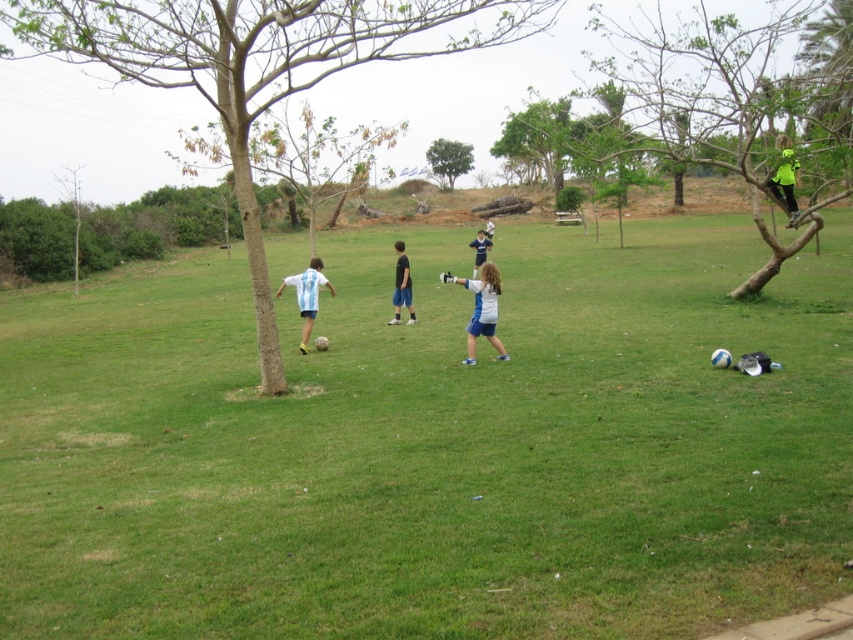
Consider the image. You are a photographer trying to capture the action of the soccer game. You want to position your camera so that the white matte shirt at center is centered in the frame. What coordinates should you aim for?

The white matte shirt at center is located at coordinates (480, 308), so you should aim your camera at those coordinates to center it in the frame.

You are a photographer standing at the camera position. You want to capture a closeup shot of the white matte shirt at center. Can you adjust your camera to focus on the subject without moving closer than 10 meters?

The white matte shirt at center is 13.40 meters away from the camera. Since the minimum focusing distance of most cameras is less than 10 meters, you would need to move closer than 10 meters to focus properly. Alternatively, use a telephoto lens to capture the closeup from that distance.